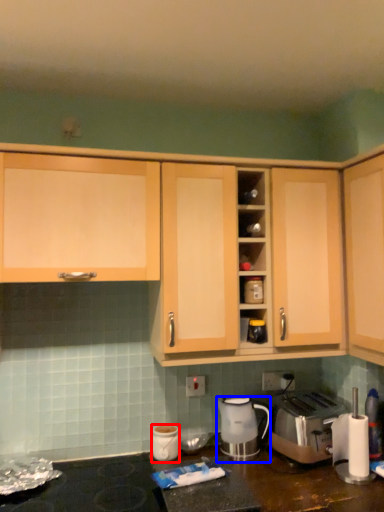
Question: Which object is further to the camera taking this photo, kitchen appliance (highlighted by a red box) or home appliance (highlighted by a blue box)?

Choices:
 (A) kitchen appliance
 (B) home appliance

Answer: (B)